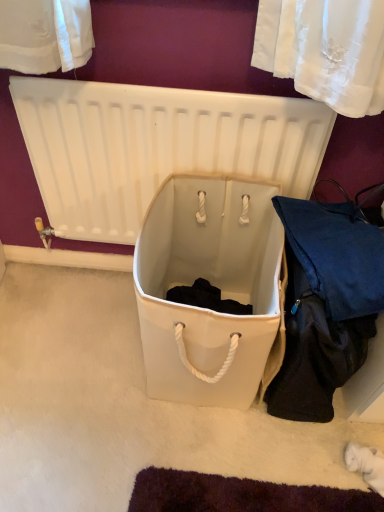
Question: Is white fabric storage box at center completely or partially outside of dark blue fabric at lower right?

Choices:
 (A) yes
 (B) no

Answer: (A)

Question: Considering the relative positions of white fabric storage box at center and dark blue fabric at lower right in the image provided, is white fabric storage box at center to the right of dark blue fabric at lower right from the viewer's perspective?

Choices:
 (A) no
 (B) yes

Answer: (A)

Question: Considering the relative sizes of white fabric storage box at center and dark blue fabric at lower right in the image provided, is white fabric storage box at center thinner than dark blue fabric at lower right?

Choices:
 (A) yes
 (B) no

Answer: (B)

Question: Can you confirm if white fabric storage box at center is shorter than dark blue fabric at lower right?

Choices:
 (A) no
 (B) yes

Answer: (B)

Question: Does white fabric storage box at center turn towards dark blue fabric at lower right?

Choices:
 (A) no
 (B) yes

Answer: (A)

Question: From the image's perspective, would you say white fabric storage box at center is positioned over dark blue fabric at lower right?

Choices:
 (A) no
 (B) yes

Answer: (B)

Question: Is dark blue fabric at lower right next to white plastic radiator at center?

Choices:
 (A) no
 (B) yes

Answer: (A)

Question: Is dark blue fabric at lower right not within white plastic radiator at center?

Choices:
 (A) no
 (B) yes

Answer: (B)

Question: Does dark blue fabric at lower right come behind white plastic radiator at center?

Choices:
 (A) no
 (B) yes

Answer: (A)

Question: Considering the relative sizes of dark blue fabric at lower right and white plastic radiator at center in the image provided, is dark blue fabric at lower right wider than white plastic radiator at center?

Choices:
 (A) no
 (B) yes

Answer: (B)

Question: Is dark blue fabric at lower right to the left of white plastic radiator at center from the viewer's perspective?

Choices:
 (A) no
 (B) yes

Answer: (A)

Question: From the image's perspective, is dark blue fabric at lower right located above white plastic radiator at center?

Choices:
 (A) yes
 (B) no

Answer: (B)

Question: Does white plastic radiator at center have a larger size compared to dark blue fabric at lower right?

Choices:
 (A) no
 (B) yes

Answer: (A)